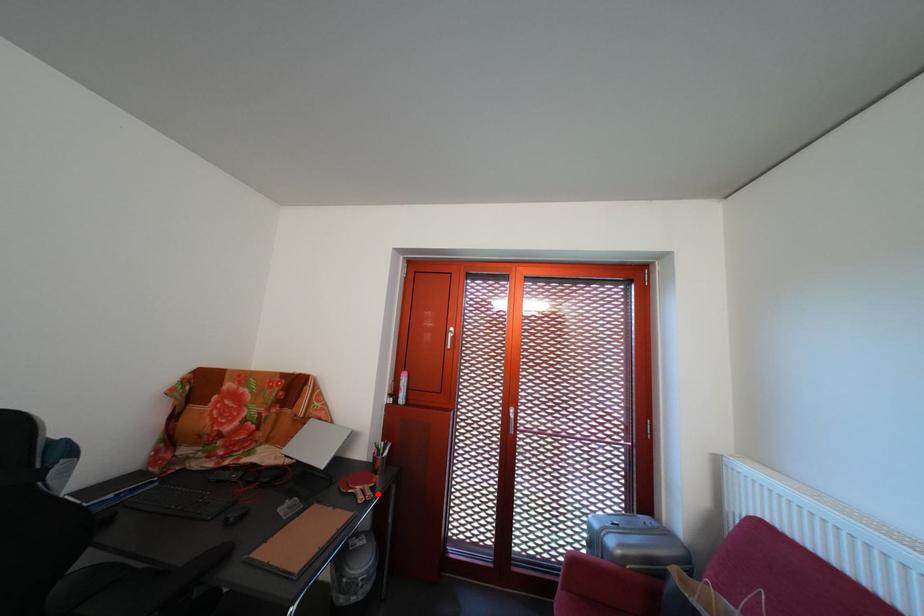
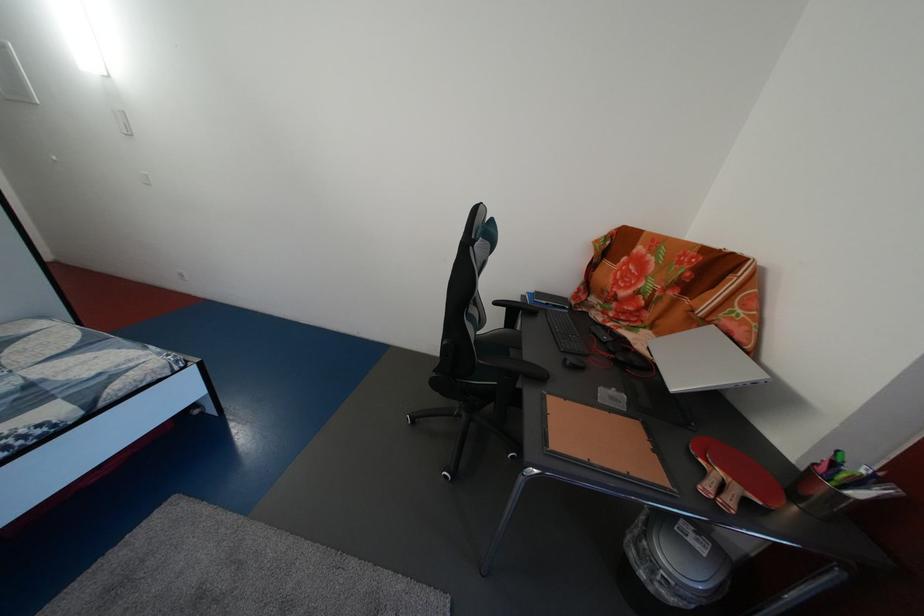
Locate, in the second image, the point that corresponds to the highlighted location in the first image.

(748, 496)